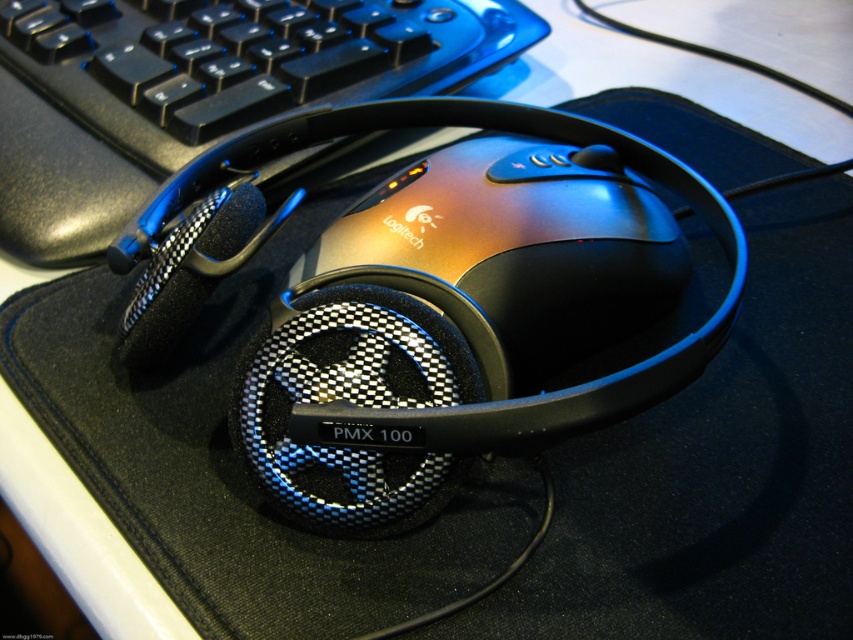
Does point (221, 60) lie behind point (566, 262)?

Yes, it is.

Can you confirm if black plastic keyboard at upper left is smaller than metallic/reflective logitech mouse at center?

No.

Between point (22, 205) and point (463, 184), which one is positioned behind?

Point (22, 205)

I want to click on black plastic keyboard at upper left, so [196, 90].